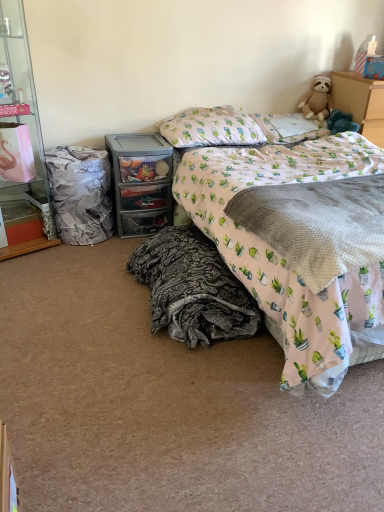
Question: Relative to pillow at upper center, arranged as the 1th pillow when viewed from the left, is pink fabric bed at center in front or behind?

Choices:
 (A) front
 (B) behind

Answer: (A)

Question: From the image's perspective, relative to pillow at upper center, arranged as the 1th pillow when viewed from the left, is pink fabric bed at center above or below?

Choices:
 (A) above
 (B) below

Answer: (B)

Question: Estimate the real-world distances between objects in this image. Which object is farther from the cactus-patterned fabric pillow at upper right, the 2th pillow viewed from the left?

Choices:
 (A) clear plastic drawer at center, which is counted as the second chest of drawers, starting from the right
 (B) fluffy beige teddy bear at upper right
 (C) gray textured blanket at center, which is the first blanket in right-to-left order
 (D) marble-patterned laundry basket at left
 (E) pillow at upper center, which is counted as the second pillow, starting from the right

Answer: (D)

Question: Based on their relative distances, which object is farther from the cactus-patterned fabric pillow at upper right, the 2th pillow viewed from the left?

Choices:
 (A) gray textured blanket at center, which is the first blanket in right-to-left order
 (B) clear plastic drawer at center, which is counted as the second chest of drawers, starting from the right
 (C) fluffy beige teddy bear at upper right
 (D) pink fabric bed at center
 (E) marble-patterned laundry basket at left

Answer: (E)